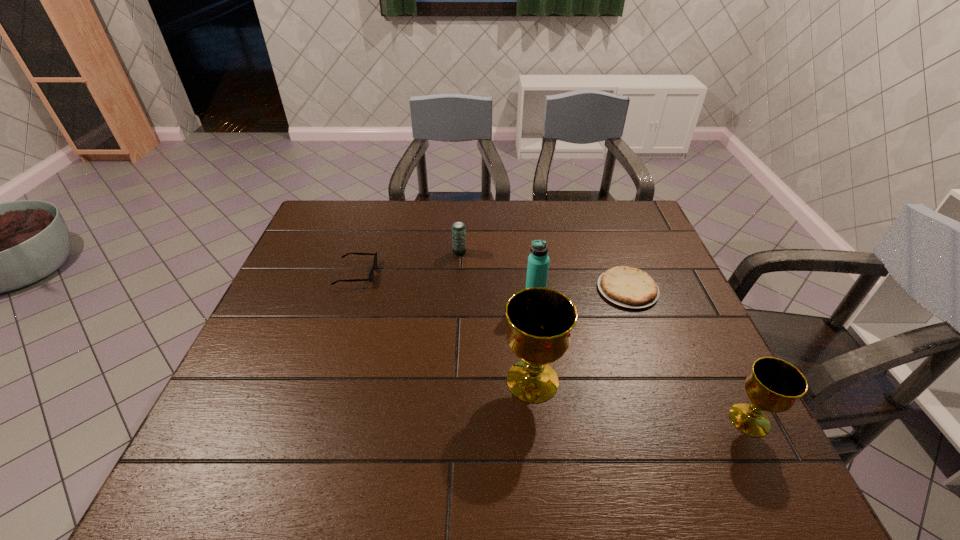
At what (x,y) coordinates should I click in order to perform the action: click on free spot between the second tallest object and the rightmost object. Please return your answer as a coordinate pair (x, y). The width and height of the screenshot is (960, 540). Looking at the image, I should click on (642, 358).

Locate an element on the screen. Image resolution: width=960 pixels, height=540 pixels. free space between the second shortest object and the third shortest object is located at coordinates (408, 263).

The height and width of the screenshot is (540, 960). Find the location of `empty space between the shortest object and the leftmost object`. empty space between the shortest object and the leftmost object is located at coordinates (492, 281).

The width and height of the screenshot is (960, 540). What are the coordinates of `empty space between the sunglasses and the fifth object from right to left` in the screenshot? It's located at (408, 263).

Locate an element on the screen. Image resolution: width=960 pixels, height=540 pixels. vacant space that's between the tallest object and the shortest object is located at coordinates (580, 335).

The height and width of the screenshot is (540, 960). Find the location of `free spot between the thermos bottle and the leftmost object`. free spot between the thermos bottle and the leftmost object is located at coordinates (445, 285).

Locate an element on the screen. This screenshot has width=960, height=540. the second closest object to the fifth shortest object is located at coordinates (540, 320).

Select which object is the fifth closest to the taller chalice. Please provide its 2D coordinates. Your answer should be formatted as a tuple, i.e. [(x, y)], where the tuple contains the x and y coordinates of a point satisfying the conditions above.

[(371, 274)]

Locate an element on the screen. This screenshot has height=540, width=960. free space that satisfies the following two spatial constraints: 1. on the back side of the taller chalice; 2. on the front-facing side of the sunglasses is located at coordinates (521, 273).

I want to click on vacant space that satisfies the following two spatial constraints: 1. on the front-facing side of the leftmost object; 2. on the back side of the second tallest object, so click(x=348, y=296).